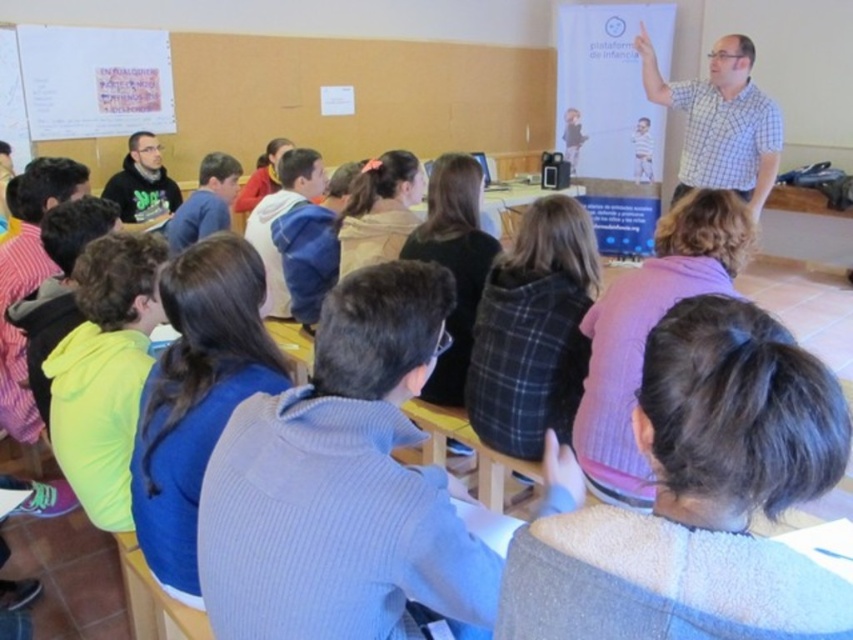
Is the position of blue fleece jacket at center less distant than that of matte black hoodie at center?

Yes, blue fleece jacket at center is closer to the viewer.

Image resolution: width=853 pixels, height=640 pixels. Find the location of `blue fleece jacket at center`. blue fleece jacket at center is located at coordinates (279, 216).

Who is more forward, (280, 316) or (204, 188)?

Point (280, 316) is more forward.

Find the location of a particular element. The image size is (853, 640). blue fleece jacket at center is located at coordinates (279, 216).

Who is shorter, checkered fabric shirt at upper right or blue fleece jacket at center?

With less height is blue fleece jacket at center.

Which is more to the left, checkered fabric shirt at upper right or blue fleece jacket at center?

From the viewer's perspective, blue fleece jacket at center appears more on the left side.

The width and height of the screenshot is (853, 640). What do you see at coordinates (721, 122) in the screenshot? I see `checkered fabric shirt at upper right` at bounding box center [721, 122].

Image resolution: width=853 pixels, height=640 pixels. Find the location of `checkered fabric shirt at upper right`. checkered fabric shirt at upper right is located at coordinates (721, 122).

Is checkered fabric shirt at upper right behind black hoodie at lower left?

No, it is not.

Is point (724, 100) more distant than point (137, 168)?

No, it is in front of (137, 168).

The width and height of the screenshot is (853, 640). Identify the location of checkered fabric shirt at upper right. (721, 122).